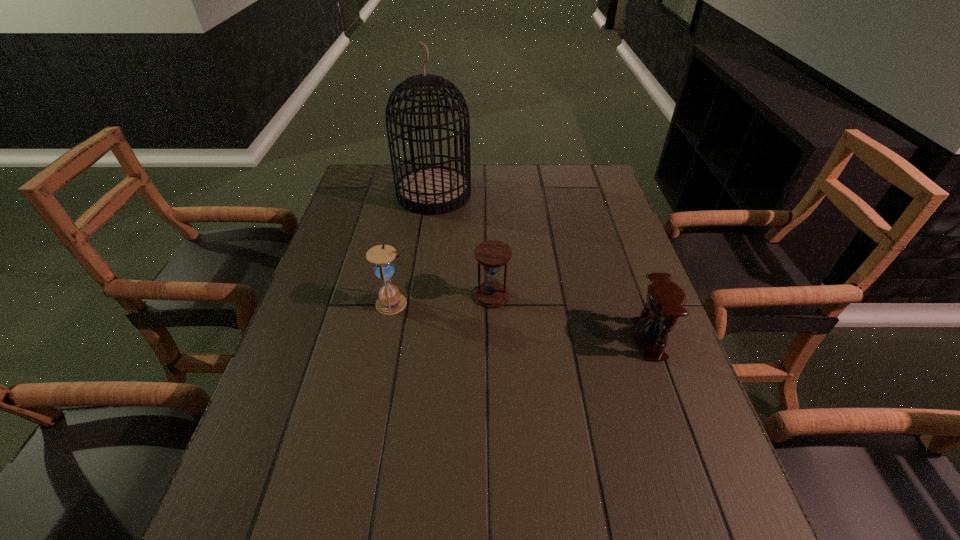
The image size is (960, 540). Identify the location of free space between the nearest object and the leftmost hourglass. (521, 321).

Locate an element on the screen. This screenshot has width=960, height=540. free spot between the nearest hourglass and the tallest object is located at coordinates (541, 267).

Where is `free spot between the third shortest object and the second hourglass from left to right`? free spot between the third shortest object and the second hourglass from left to right is located at coordinates (444, 300).

Locate an element on the screen. The height and width of the screenshot is (540, 960). free spot between the farthest object and the second hourglass from right to left is located at coordinates point(463,245).

Where is `free point between the third object from left to right and the nearest hourglass`? free point between the third object from left to right and the nearest hourglass is located at coordinates (570, 318).

Identify which object is located as the third nearest to the rightmost object. Please provide its 2D coordinates. Your answer should be formatted as a tuple, i.e. [(x, y)], where the tuple contains the x and y coordinates of a point satisfying the conditions above.

[(432, 190)]

This screenshot has height=540, width=960. Identify the location of object that can be found as the closest to the second object from right to left. (390, 302).

Point out which hourglass is positioned as the nearest to the second tallest object. Please provide its 2D coordinates. Your answer should be formatted as a tuple, i.e. [(x, y)], where the tuple contains the x and y coordinates of a point satisfying the conditions above.

[(492, 254)]

Identify which hourglass is located as the nearest to the second hourglass from left to right. Please provide its 2D coordinates. Your answer should be formatted as a tuple, i.e. [(x, y)], where the tuple contains the x and y coordinates of a point satisfying the conditions above.

[(390, 302)]

At what (x,y) coordinates should I click in order to perform the action: click on free space that satisfies the following two spatial constraints: 1. on the front side of the tallest object; 2. on the left side of the third object from left to right. Please return your answer as a coordinate pair (x, y). Image resolution: width=960 pixels, height=540 pixels. Looking at the image, I should click on [x=420, y=296].